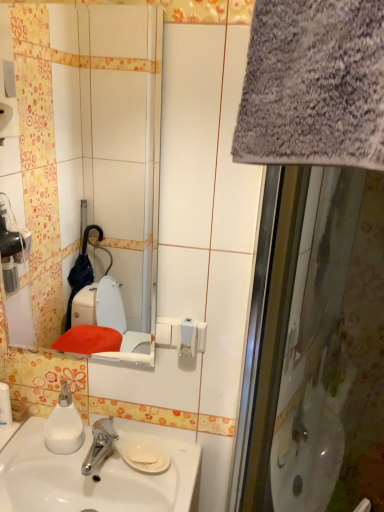
What do you see at coordinates (92, 475) in the screenshot? I see `white glossy sink at lower left` at bounding box center [92, 475].

Measure the distance between white matte soap dispenser at lower left and camera.

white matte soap dispenser at lower left is 3.55 feet from camera.

What do you see at coordinates (5, 405) in the screenshot?
I see `white glossy soap dispenser at lower left` at bounding box center [5, 405].

Image resolution: width=384 pixels, height=512 pixels. Describe the element at coordinates (85, 146) in the screenshot. I see `white glossy mirror at upper center` at that location.

Find the location of a particular element. The image size is (384, 512). white glossy mirror at upper center is located at coordinates (85, 146).

Where is `white glossy sink at lower left`? This screenshot has height=512, width=384. white glossy sink at lower left is located at coordinates (92, 475).

Is white glossy mirror at upper center next to white glossy sink at lower left and touching it?

white glossy mirror at upper center and white glossy sink at lower left are clearly separated.

From the image's perspective, relative to white glossy sink at lower left, is white glossy mirror at upper center above or below?

white glossy mirror at upper center is situated higher than white glossy sink at lower left in the image.

Who is shorter, white glossy mirror at upper center or white glossy sink at lower left?

white glossy sink at lower left.

From a real-world perspective, which object rests below the other?

From a 3D spatial view, white glossy sink at lower left is below.

Which is behind, white matte soap dispenser at lower left or white glossy sink at lower left?

white matte soap dispenser at lower left is further from the camera.

Is white matte soap dispenser at lower left not inside white glossy sink at lower left?

Yes, white matte soap dispenser at lower left is located beyond the bounds of white glossy sink at lower left.

Which is more to the right, white matte soap dispenser at lower left or white glossy sink at lower left?

From the viewer's perspective, white glossy sink at lower left appears more on the right side.

From the image's perspective, is white matte soap dispenser at lower left over white glossy soap dispenser at lower left?

Incorrect, from the image's perspective, white matte soap dispenser at lower left is lower than white glossy soap dispenser at lower left.

Based on the photo, is white glossy soap dispenser at lower left at the back of white matte soap dispenser at lower left?

No, white matte soap dispenser at lower left's orientation is not away from white glossy soap dispenser at lower left.

Considering the sizes of objects white matte soap dispenser at lower left and white glossy soap dispenser at lower left in the image provided, who is bigger, white matte soap dispenser at lower left or white glossy soap dispenser at lower left?

white matte soap dispenser at lower left.

Considering the positions of points (72, 417) and (9, 426), is point (72, 417) farther from camera compared to point (9, 426)?

That is False.

Does white glossy mirror at upper center turn towards white glossy soap dispenser at lower left?

No.

Where is `toiletry that is under the white glossy mirror at upper center (from a real-world perspective)`? The image size is (384, 512). toiletry that is under the white glossy mirror at upper center (from a real-world perspective) is located at coordinates (5, 405).

Is white glossy soap dispenser at lower left a part of white glossy mirror at upper center?

No, white glossy soap dispenser at lower left is not inside white glossy mirror at upper center.

Is white glossy mirror at upper center taller or shorter than white glossy soap dispenser at lower left?

Considering their sizes, white glossy mirror at upper center has more height than white glossy soap dispenser at lower left.

Does white matte soap dispenser at lower left have a lesser width compared to white glossy mirror at upper center?

In fact, white matte soap dispenser at lower left might be wider than white glossy mirror at upper center.

Which object is more forward, white matte soap dispenser at lower left or white glossy mirror at upper center?

white glossy mirror at upper center.

From the image's perspective, does white matte soap dispenser at lower left appear higher than white glossy mirror at upper center?

No, from the image's perspective, white matte soap dispenser at lower left is not over white glossy mirror at upper center.

Is white matte soap dispenser at lower left next to white glossy mirror at upper center and touching it?

No, white matte soap dispenser at lower left is not touching white glossy mirror at upper center.

From a real-world perspective, is white glossy sink at lower left on top of white glossy mirror at upper center?

No, from a real-world perspective, white glossy sink at lower left is not over white glossy mirror at upper center

Who is smaller, white glossy sink at lower left or white glossy mirror at upper center?

With smaller size is white glossy mirror at upper center.

Can you confirm if white glossy sink at lower left is wider than white glossy mirror at upper center?

Indeed, white glossy sink at lower left has a greater width compared to white glossy mirror at upper center.

Is white glossy mirror at upper center at the back of white glossy sink at lower left?

white glossy sink at lower left does not have its back to white glossy mirror at upper center.

Is white glossy mirror at upper center turned away from gray fabric screen door at right?

white glossy mirror at upper center is not turned away from gray fabric screen door at right.

Which is correct: white glossy mirror at upper center is inside gray fabric screen door at right, or outside of it?

The correct answer is: outside.

From a real-world perspective, is white glossy mirror at upper center physically above gray fabric screen door at right?

Yes, from a real-world perspective, white glossy mirror at upper center is above gray fabric screen door at right.

Considering the relative sizes of white glossy mirror at upper center and gray fabric screen door at right in the image provided, is white glossy mirror at upper center bigger than gray fabric screen door at right?

Actually, white glossy mirror at upper center might be smaller than gray fabric screen door at right.

Locate an element on the screen. mirror above the white glossy sink at lower left (from the image's perspective) is located at coordinates (85, 146).

The image size is (384, 512). I want to click on sink located underneath the white matte soap dispenser at lower left (from a real-world perspective), so click(x=92, y=475).

Based on the photo, which object lies further to the anchor point white matte soap dispenser at lower left, gray fabric screen door at right or white glossy mirror at upper center?

white glossy mirror at upper center.

Looking at the image, which one is located closer to white glossy mirror at upper center, gray fabric screen door at right or white glossy sink at lower left?

Among the two, white glossy sink at lower left is located nearer to white glossy mirror at upper center.

Based on their spatial positions, is white glossy sink at lower left or white glossy mirror at upper center further from white matte soap dispenser at lower left?

Based on the image, white glossy mirror at upper center appears to be further to white matte soap dispenser at lower left.

Looking at the image, which one is located further to white glossy soap dispenser at lower left, gray fabric screen door at right or white matte soap dispenser at lower left?

Among the two, gray fabric screen door at right is located further to white glossy soap dispenser at lower left.

Which object lies nearer to the anchor point white glossy mirror at upper center, white glossy sink at lower left or white matte soap dispenser at lower left?

white glossy sink at lower left is closer to white glossy mirror at upper center.

Estimate the real-world distances between objects in this image. Which object is closer to white glossy soap dispenser at lower left, gray fabric screen door at right or white glossy sink at lower left?

white glossy sink at lower left lies closer to white glossy soap dispenser at lower left than the other object.

Estimate the real-world distances between objects in this image. Which object is closer to white matte soap dispenser at lower left, gray fabric screen door at right or white glossy sink at lower left?

white glossy sink at lower left lies closer to white matte soap dispenser at lower left than the other object.

Based on their spatial positions, is white glossy soap dispenser at lower left or white glossy sink at lower left closer to white glossy mirror at upper center?

The object closer to white glossy mirror at upper center is white glossy sink at lower left.

Identify the location of toiletry between white glossy mirror at upper center and white glossy sink at lower left in the vertical direction. (5, 405).

You are a GUI agent. You are given a task and a screenshot of the screen. Output one action in this format:
    pyautogui.click(x=<x>, y=<y>)
    Task: Click on the soap dispenser positioned between gray fabric screen door at right and white glossy soap dispenser at lower left from near to far
    The width and height of the screenshot is (384, 512).
    Given the screenshot: What is the action you would take?
    pyautogui.click(x=64, y=425)

Where is `mirror positioned between gray fabric screen door at right and white glossy sink at lower left from near to far`? mirror positioned between gray fabric screen door at right and white glossy sink at lower left from near to far is located at coordinates (85, 146).

This screenshot has height=512, width=384. I want to click on mirror between gray fabric screen door at right and white matte soap dispenser at lower left along the z-axis, so click(x=85, y=146).